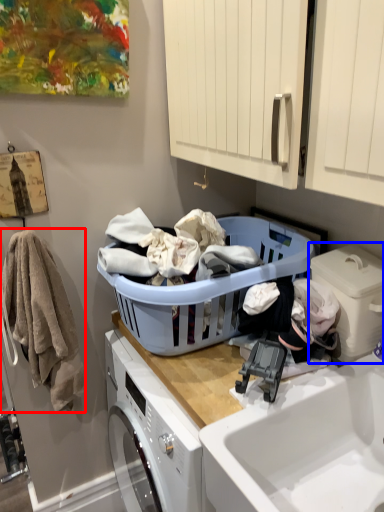
Question: Among these objects, which one is nearest to the camera, clothing (highlighted by a red box) or washing machine (highlighted by a blue box)?

Choices:
 (A) clothing
 (B) washing machine

Answer: (B)